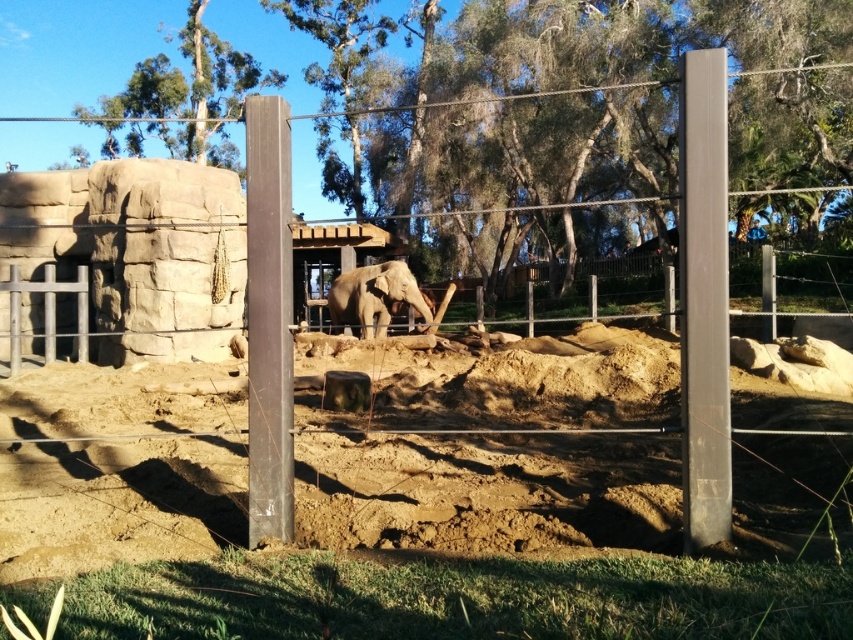
Consider the image. You are a zookeeper who needs to check the camera located near the smooth gray pole at right. Given that the enclosure fence is electrified and you must stay outside the enclosure, can you safely reach the camera without entering the enclosure?

The smooth gray pole at right and camera are 14.99 feet apart. Since the camera is 15 feet away from the pole, you can safely reach it without entering the enclosure as the distance is sufficient to access it from outside.